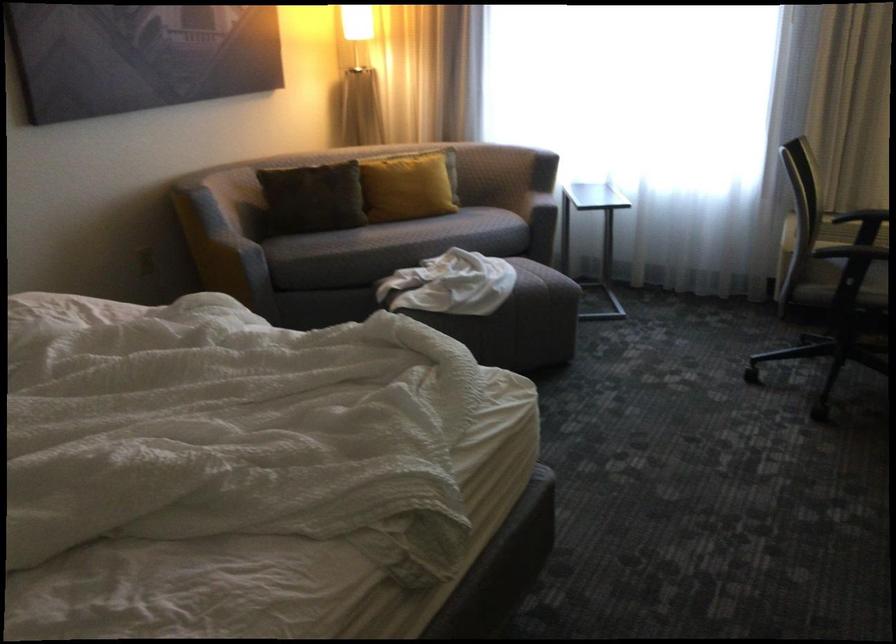
Locate an element on the screen. sofa sitting surface is located at coordinates (425, 234).